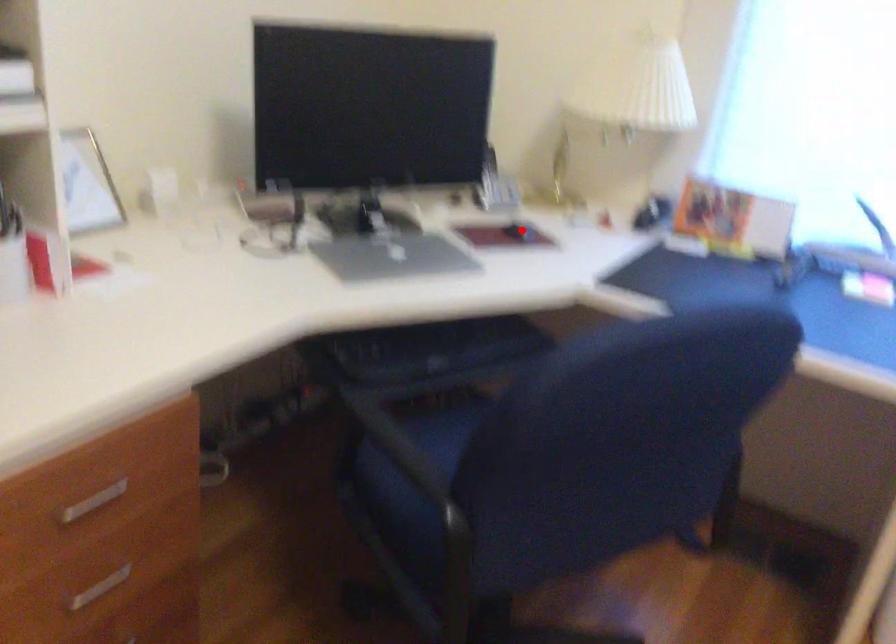
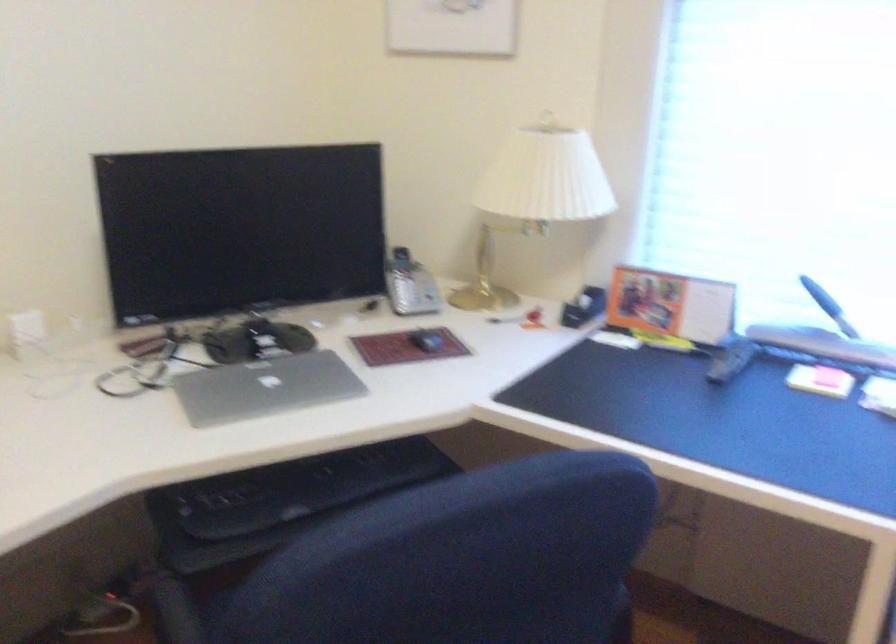
Question: I am providing you with two images of the same scene from different viewpoints. A red point is marked on the first image. Can you still see the location of the red point in image 2?

Choices:
 (A) Yes
 (B) No

Answer: (A)